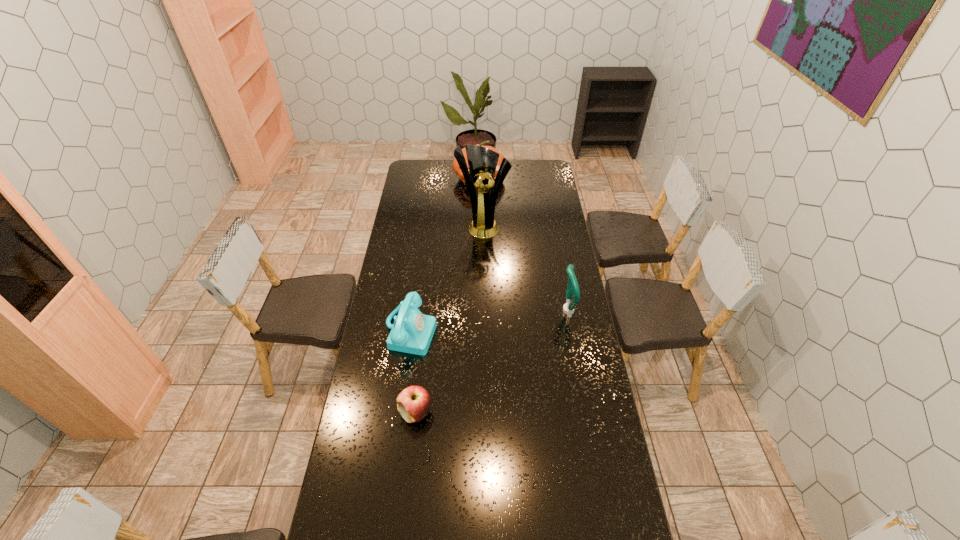
Identify the location of free space on the desktop that is between the nearest object and the bottle opener and is positioned on the dial of the telephone. This screenshot has height=540, width=960. (513, 347).

Where is `vacant space on the desktop that is between the nearest object and the rightmost object and is positioned at the front of the award, where the globe is visible`? Image resolution: width=960 pixels, height=540 pixels. vacant space on the desktop that is between the nearest object and the rightmost object and is positioned at the front of the award, where the globe is visible is located at coordinates coord(516,345).

At what (x,y) coordinates should I click in order to perform the action: click on vacant space on the desktop that is between the shortest object and the bottle opener and is positioned on the front face of the pumpkin. Please return your answer as a coordinate pair (x, y). Looking at the image, I should click on (510, 349).